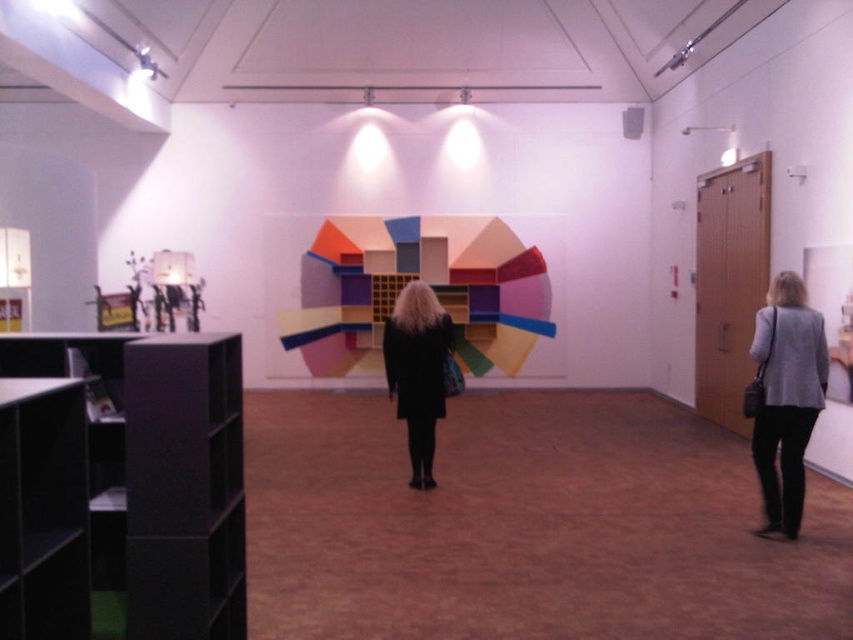
Question: Does multicolored painted geometric shapes at center appear on the right side of black matte coat at center?

Choices:
 (A) yes
 (B) no

Answer: (B)

Question: Considering the real-world distances, which object is farthest from the gray fabric jacket at lower right?

Choices:
 (A) black matte coat at center
 (B) matte black bookshelf at left
 (C) multicolored painted geometric shapes at center

Answer: (C)

Question: Does matte black bookshelf at left appear on the right side of multicolored painted geometric shapes at center?

Choices:
 (A) no
 (B) yes

Answer: (A)

Question: Which point is closer to the camera?

Choices:
 (A) multicolored painted geometric shapes at center
 (B) gray fabric jacket at lower right

Answer: (B)

Question: Which of these objects is positioned closest to the multicolored painted geometric shapes at center?

Choices:
 (A) gray fabric jacket at lower right
 (B) matte black bookshelf at left

Answer: (A)

Question: Is gray fabric jacket at lower right bigger than black matte coat at center?

Choices:
 (A) yes
 (B) no

Answer: (B)